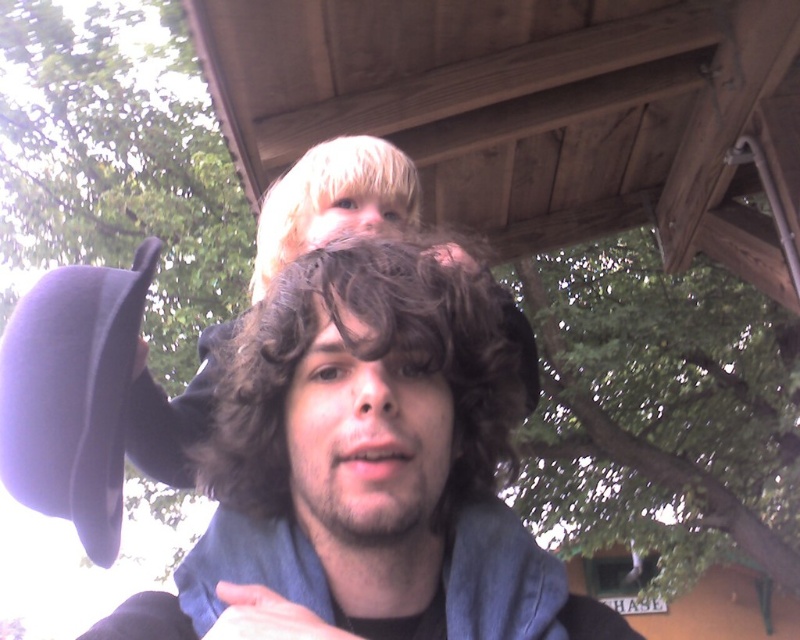
Based on the scene description, which object is wider when comparing the curly brown hair at center and the matte purple hat at left?

The curly brown hair at center is wider than the matte purple hat at left according to the description.

You are a photographer trying to capture both the curly brown hair at center and the matte purple hat at left in a single shot. Based on their positions, can you tell which object is closer to the camera?

The curly brown hair at center is closer to the camera because it is in front of the matte purple hat at left.